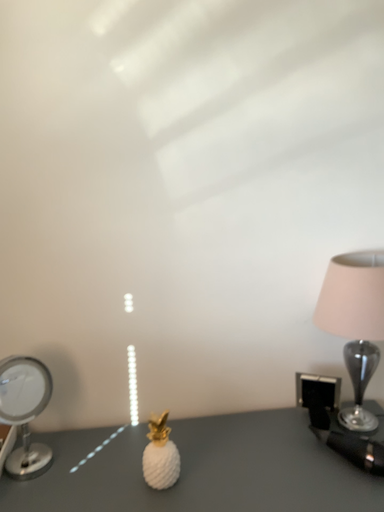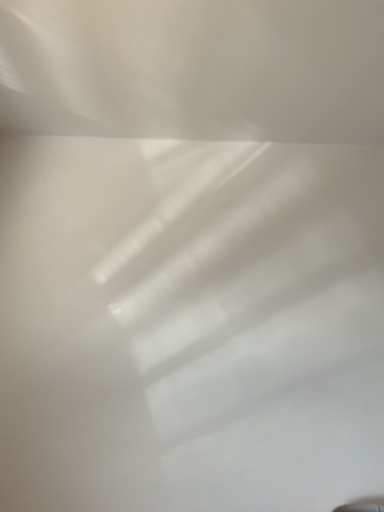
Question: Which way did the camera rotate in the video?

Choices:
 (A) rotated upward
 (B) rotated downward

Answer: (A)